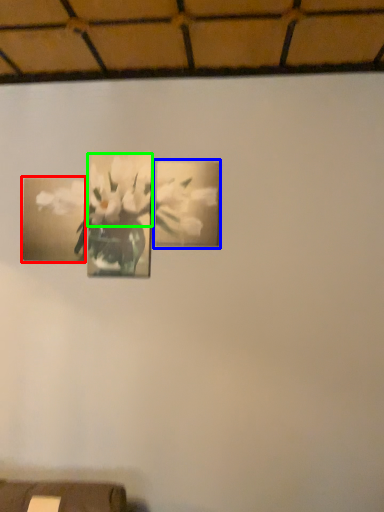
Question: Considering the real-world distances, which object is farthest from picture frame (highlighted by a red box)? picture frame (highlighted by a blue box) or flower (highlighted by a green box)?

Choices:
 (A) picture frame
 (B) flower

Answer: (A)